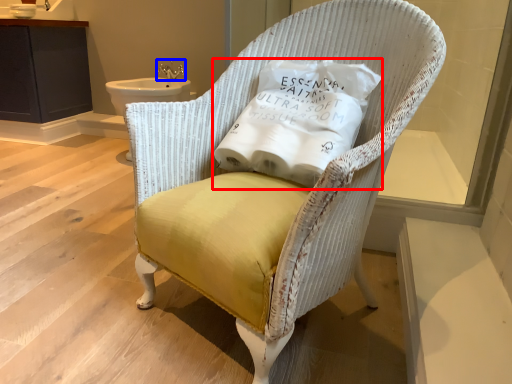
Question: Which object appears farthest to the camera in this image, pillow (highlighted by a red box) or faucet (highlighted by a blue box)?

Choices:
 (A) pillow
 (B) faucet

Answer: (B)